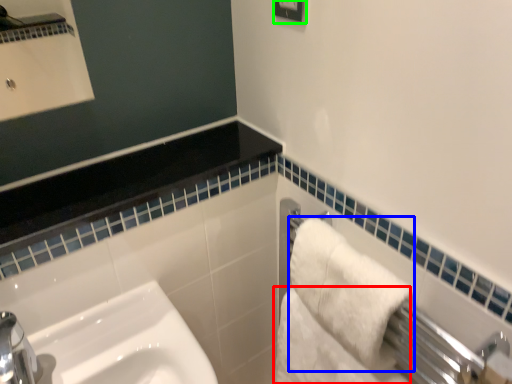
Question: Considering the real-world distances, which object is closest to bath towel (highlighted by a red box)? bath towel (highlighted by a blue box) or square (highlighted by a green box).

Choices:
 (A) bath towel
 (B) square

Answer: (A)